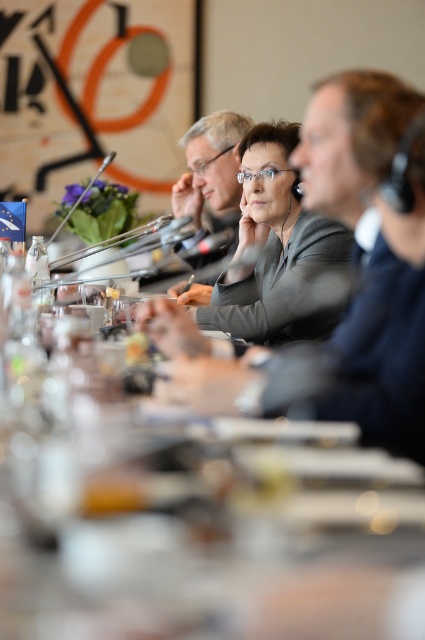
Does clear plastic cups at center lie in front of matte gray suit at center?

Yes, clear plastic cups at center is in front of matte gray suit at center.

Between clear plastic cups at center and matte gray suit at center, which one appears on the left side from the viewer's perspective?

From the viewer's perspective, clear plastic cups at center appears more on the left side.

What do you see at coordinates (193, 516) in the screenshot? The height and width of the screenshot is (640, 425). I see `clear plastic cups at center` at bounding box center [193, 516].

Locate an element on the screen. This screenshot has height=640, width=425. clear plastic cups at center is located at coordinates (193, 516).

Does point (396, 524) lie in front of point (231, 243)?

Yes, it is in front of point (231, 243).

Does clear plastic cups at center come in front of matte black glasses at center?

Yes, it is in front of matte black glasses at center.

Who is more forward, [251,464] or [189,170]?

Point [251,464]

Identify the location of clear plastic cups at center. (193, 516).

Does matte gray suit at center appear under matte black glasses at center?

Yes.

Between matte gray suit at center and matte black glasses at center, which one has more height?

Standing taller between the two is matte gray suit at center.

The height and width of the screenshot is (640, 425). Describe the element at coordinates (360, 273) in the screenshot. I see `matte gray suit at center` at that location.

Locate an element on the screen. The height and width of the screenshot is (640, 425). matte gray suit at center is located at coordinates (360, 273).